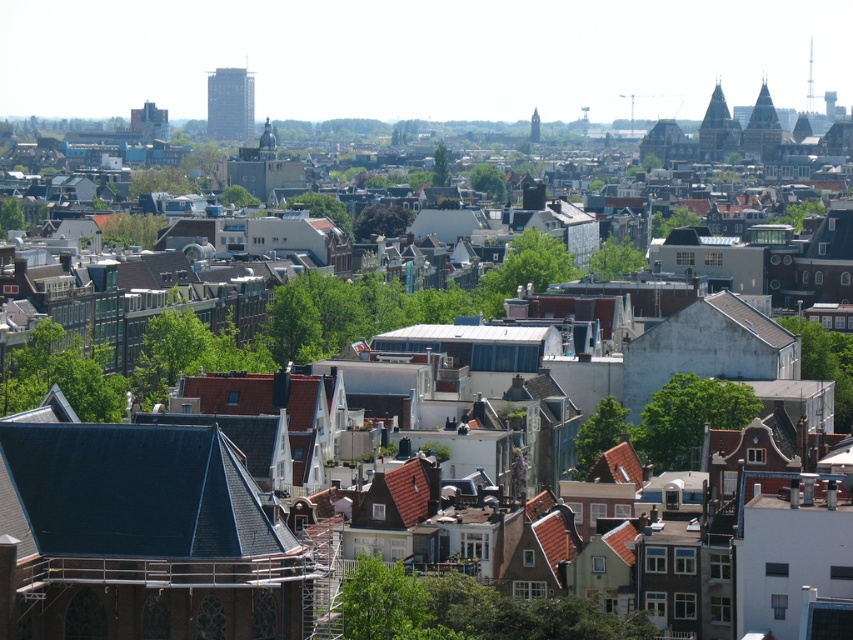
Question: Which point appears closest to the camera in this image?

Choices:
 (A) (531, 138)
 (B) (717, 141)
 (C) (209, 122)

Answer: (B)

Question: Which point is farther to the camera?

Choices:
 (A) (248, 124)
 (B) (717, 109)

Answer: (A)

Question: Is dark brown stone tower at upper right below smooth silver spire at upper center?

Choices:
 (A) yes
 (B) no

Answer: (A)

Question: Is glassy modern skyscraper at upper center to the left of brick tower at center from the viewer's perspective?

Choices:
 (A) no
 (B) yes

Answer: (B)

Question: Can you confirm if brown stone tower at upper right is smaller than smooth silver spire at upper center?

Choices:
 (A) no
 (B) yes

Answer: (A)

Question: Which of the following is the closest to the observer?

Choices:
 (A) glassy modern skyscraper at upper center
 (B) dark brown stone tower at upper right
 (C) brown stone tower at upper right

Answer: (C)